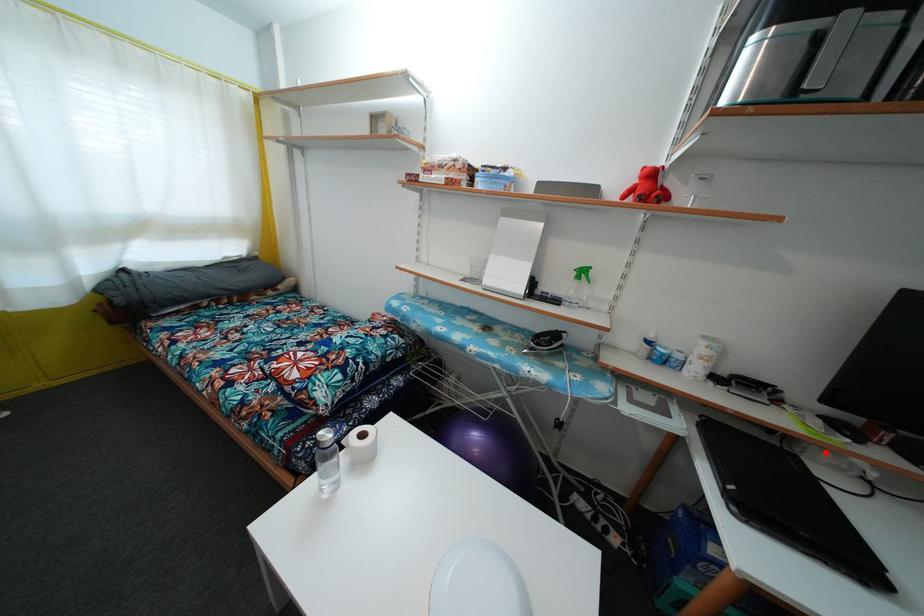
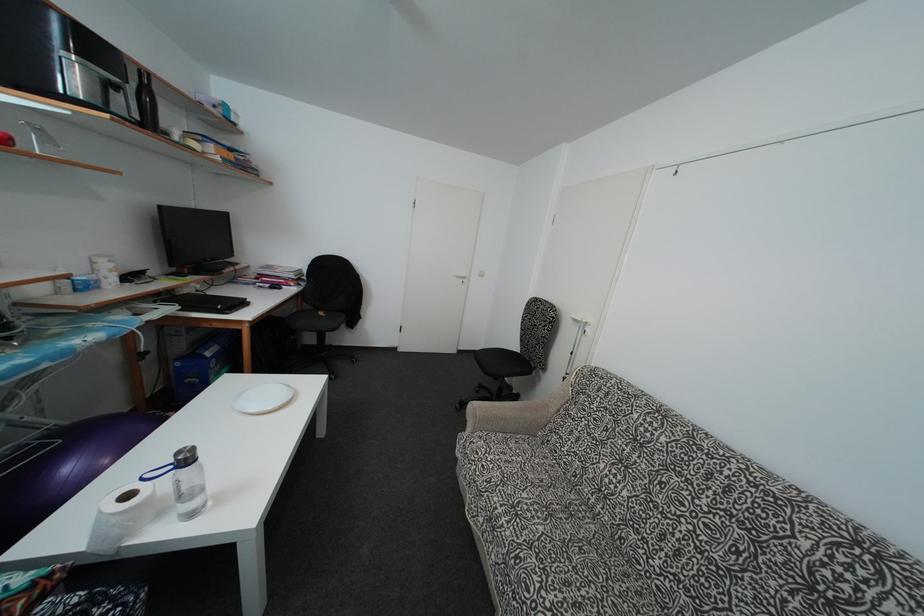
Find the pixel in the second image that matches the highlighted location in the first image.

(185, 294)